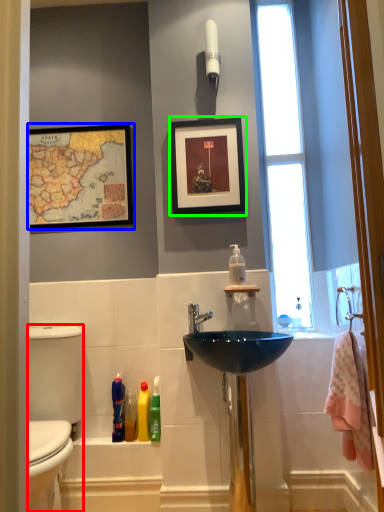
Question: Which object is positioned closest to gray (highlighted by a red box)? Select from picture frame (highlighted by a blue box) and picture frame (highlighted by a green box).

Choices:
 (A) picture frame
 (B) picture frame

Answer: (A)